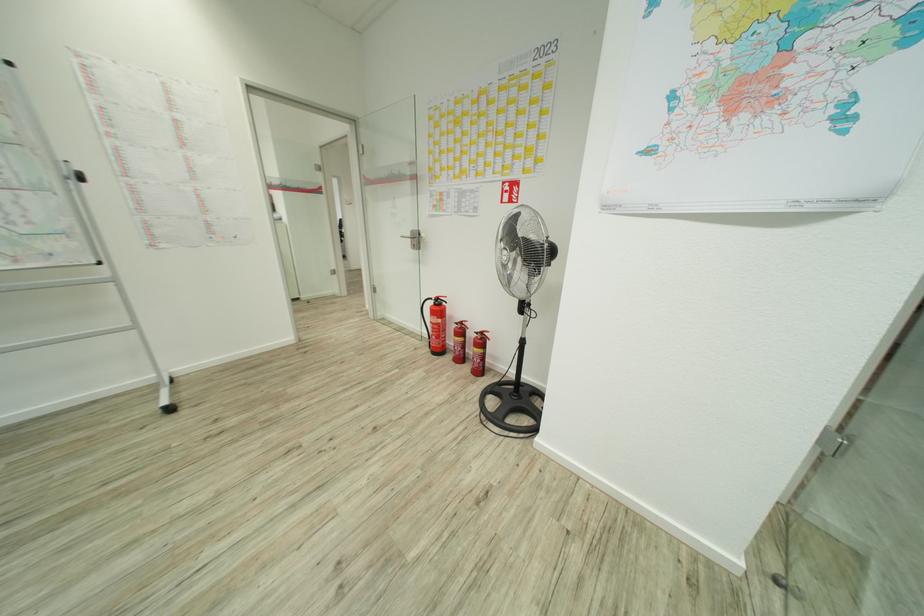
Where is `whiteboard stand wheel`? This screenshot has height=616, width=924. whiteboard stand wheel is located at coordinates (168, 408).